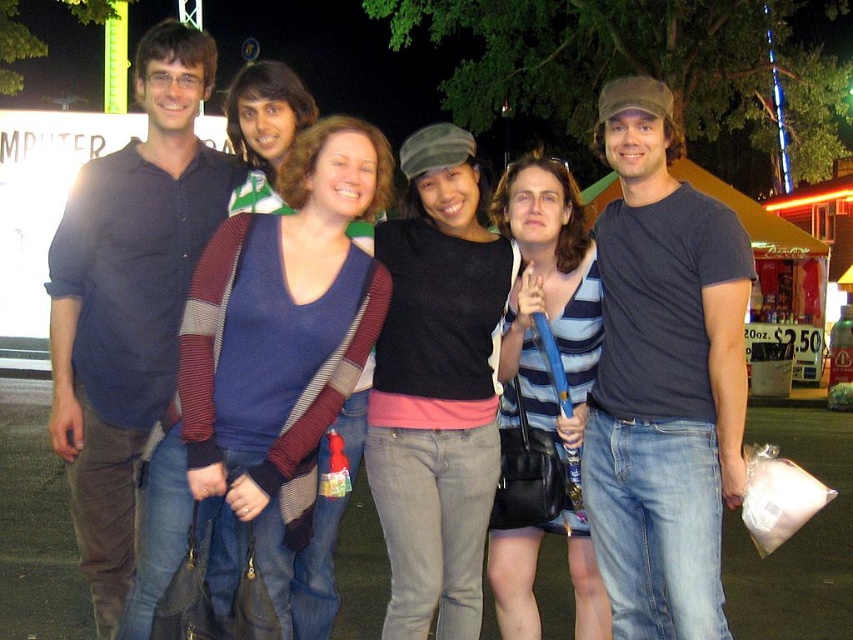
Describe the element at coordinates (663, 378) in the screenshot. I see `dark blue t-shirt at center` at that location.

Who is higher up, dark blue t-shirt at center or dark blue shirt at left?

Positioned higher is dark blue shirt at left.

Which is behind, point (631, 556) or point (108, 348)?

The point (108, 348) is more distant.

Where is `dark blue t-shirt at center`? dark blue t-shirt at center is located at coordinates click(663, 378).

Is dark blue t-shirt at center below matte black sweater at center?

No, dark blue t-shirt at center is not below matte black sweater at center.

From the picture: Does dark blue t-shirt at center have a larger size compared to matte black sweater at center?

Correct, dark blue t-shirt at center is larger in size than matte black sweater at center.

Is point (625, 193) positioned before point (444, 257)?

That is True.

Locate an element on the screen. The width and height of the screenshot is (853, 640). dark blue t-shirt at center is located at coordinates (663, 378).

Does dark blue shirt at left have a lesser width compared to matte black sweater at center?

Indeed, dark blue shirt at left has a lesser width compared to matte black sweater at center.

Between dark blue shirt at left and matte black sweater at center, which one is positioned lower?

matte black sweater at center is lower down.

Locate an element on the screen. dark blue shirt at left is located at coordinates (129, 298).

Locate an element on the screen. dark blue shirt at left is located at coordinates 129,298.